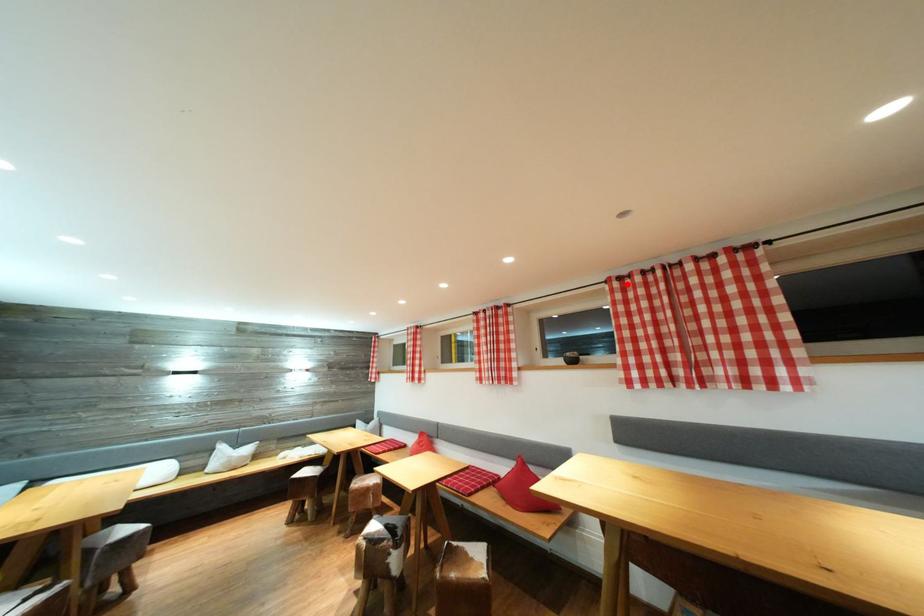
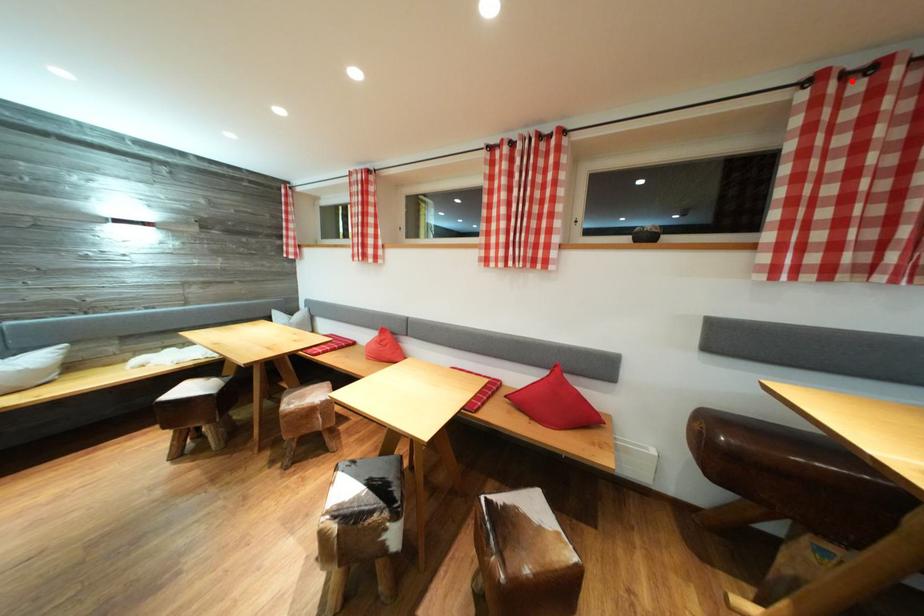
I am providing you with two images of the same scene from different viewpoints. A red point is marked on the first image and another point is marked on the second image. Does the point marked in image1 correspond to the same location as the one in image2?

Yes